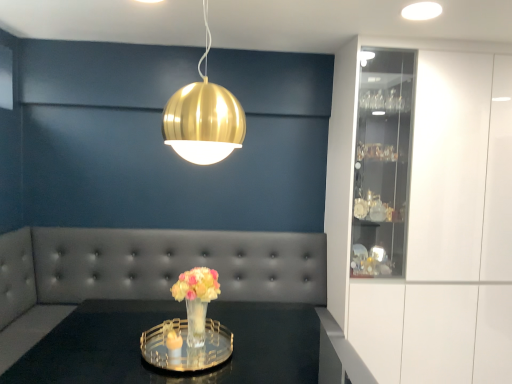
You are a GUI agent. You are given a task and a screenshot of the screen. Output one action in this format:
    pyautogui.click(x=<x>, y=<y>)
    Task: Click on the free spot to the right of translucent glass vase at center
    
    Given the screenshot: What is the action you would take?
    pyautogui.click(x=250, y=350)